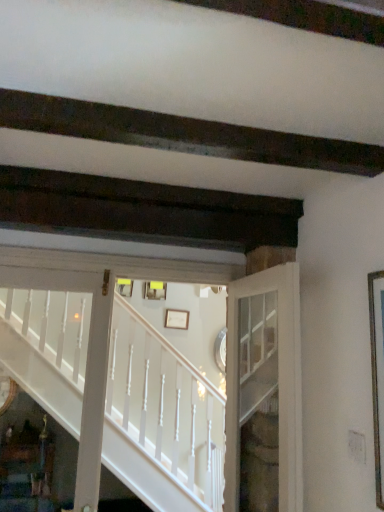
Image resolution: width=384 pixels, height=512 pixels. Describe the element at coordinates (155, 290) in the screenshot. I see `matte yellow picture frame at center, which is counted as the first picture frame, starting from the top` at that location.

The height and width of the screenshot is (512, 384). Describe the element at coordinates (266, 378) in the screenshot. I see `white glass door at center` at that location.

This screenshot has height=512, width=384. Find the location of `white glass door at center`. white glass door at center is located at coordinates tap(266, 378).

In order to face white matte picture frame at center, the 2th picture frame positioned from the left, should I rotate leftwards or rightwards?

You should look left and rotate roughly 2.066 degrees.

Where is `white matte picture frame at center, which is the 1th picture frame from bottom to top`? This screenshot has width=384, height=512. white matte picture frame at center, which is the 1th picture frame from bottom to top is located at coordinates [177, 319].

Where is `matte yellow picture frame at center, which appears as the 2th picture frame when viewed from the right`? The image size is (384, 512). matte yellow picture frame at center, which appears as the 2th picture frame when viewed from the right is located at coordinates (x=155, y=290).

Locate an element on the screen. The height and width of the screenshot is (512, 384). picture frame located below the white painted wood stairs at center (from the image's perspective) is located at coordinates (177, 319).

Based on the photo, how distant is white matte picture frame at center, the 2th picture frame positioned from the left, from white painted wood stairs at center?

1.78 meters.

In terms of height, does white matte picture frame at center, the 2th picture frame positioned from the left, look taller or shorter compared to white painted wood stairs at center?

Clearly, white matte picture frame at center, the 2th picture frame positioned from the left, is shorter compared to white painted wood stairs at center.

Is white matte picture frame at center, which is the second picture frame in top-to-bottom order, thinner than white painted wood stairs at center?

Yes.

From the picture: From the image's perspective, who appears lower, matte yellow picture frame at center, which appears as the 2th picture frame when viewed from the right, or white painted wood stairs at center?

From the image's view, white painted wood stairs at center is below.

Is white painted wood stairs at center located within matte yellow picture frame at center, which appears as the 2th picture frame when viewed from the right?

No, matte yellow picture frame at center, which appears as the 2th picture frame when viewed from the right, does not contain white painted wood stairs at center.

Considering the relative sizes of matte yellow picture frame at center, which is counted as the first picture frame, starting from the top, and white painted wood stairs at center in the image provided, is matte yellow picture frame at center, which is counted as the first picture frame, starting from the top, smaller than white painted wood stairs at center?

Yes, matte yellow picture frame at center, which is counted as the first picture frame, starting from the top, is smaller than white painted wood stairs at center.

Considering the sizes of matte yellow picture frame at center, which is counted as the first picture frame, starting from the top, and white painted wood stairs at center in the image, is matte yellow picture frame at center, which is counted as the first picture frame, starting from the top, taller or shorter than white painted wood stairs at center?

Clearly, matte yellow picture frame at center, which is counted as the first picture frame, starting from the top, is shorter compared to white painted wood stairs at center.

What's the angular difference between white painted wood stairs at center and matte yellow picture frame at center, which is counted as the first picture frame, starting from the top,'s facing directions?

They differ by 1.36 degrees in their facing directions.

From the image's perspective, between white painted wood stairs at center and matte yellow picture frame at center, which appears as the 2th picture frame when viewed from the right, who is located below?

white painted wood stairs at center, from the image's perspective.

Considering the sizes of white painted wood stairs at center and matte yellow picture frame at center, which appears as the 2th picture frame when viewed from the right, in the image, is white painted wood stairs at center wider or thinner than matte yellow picture frame at center, which appears as the 2th picture frame when viewed from the right,?

In the image, white painted wood stairs at center appears to be wider than matte yellow picture frame at center, which appears as the 2th picture frame when viewed from the right.

Considering the positions of objects white glass door at center and white painted wood stairs at center in the image provided, who is behind, white glass door at center or white painted wood stairs at center?

Positioned behind is white painted wood stairs at center.

From the image's perspective, is white glass door at center above or below white painted wood stairs at center?

white glass door at center is situated lower than white painted wood stairs at center in the image.

How different are the orientations of white glass door at center and white painted wood stairs at center in degrees?

There is a 85.3-degree angle between the facing directions of white glass door at center and white painted wood stairs at center.

You are a GUI agent. You are given a task and a screenshot of the screen. Output one action in this format:
    pyautogui.click(x=<x>, y=<y>)
    Task: Click on the stairs behind the white glass door at center
    
    Given the screenshot: What is the action you would take?
    pyautogui.click(x=145, y=473)

This screenshot has width=384, height=512. I want to click on door on the right of matte yellow picture frame at center, which is counted as the first picture frame, starting from the top, so pyautogui.click(x=266, y=378).

Is white glass door at center next to matte yellow picture frame at center, placed as the 1th picture frame when sorted from left to right?

No, white glass door at center is not making contact with matte yellow picture frame at center, placed as the 1th picture frame when sorted from left to right.

From the image's perspective, is white glass door at center below matte yellow picture frame at center, placed as the 1th picture frame when sorted from left to right?

Yes, from the image's perspective, white glass door at center is beneath matte yellow picture frame at center, placed as the 1th picture frame when sorted from left to right.

Are white glass door at center and white matte picture frame at center, which is the 1th picture frame from bottom to top, making contact?

No, white glass door at center is not with white matte picture frame at center, which is the 1th picture frame from bottom to top.

Is white glass door at center inside or outside of white matte picture frame at center, marked as the first picture frame in a right-to-left arrangement?

white glass door at center is not enclosed by white matte picture frame at center, marked as the first picture frame in a right-to-left arrangement.

Is white glass door at center oriented towards white matte picture frame at center, the 2th picture frame positioned from the left?

No, white glass door at center does not turn towards white matte picture frame at center, the 2th picture frame positioned from the left.

Where is `door above the white matte picture frame at center, which is the second picture frame in top-to-bottom order (from the image's perspective)`? door above the white matte picture frame at center, which is the second picture frame in top-to-bottom order (from the image's perspective) is located at coordinates (266, 378).

Considering their positions, is matte yellow picture frame at center, which is counted as the first picture frame, starting from the top, located in front of or behind white glass door at center?

In the image, matte yellow picture frame at center, which is counted as the first picture frame, starting from the top, appears behind white glass door at center.

In the scene shown: How different are the orientations of matte yellow picture frame at center, placed as the 1th picture frame when sorted from left to right, and white glass door at center in degrees?

83.9 degrees separate the facing orientations of matte yellow picture frame at center, placed as the 1th picture frame when sorted from left to right, and white glass door at center.

Is matte yellow picture frame at center, which appears as the 2th picture frame when viewed from the right, completely or partially outside of white glass door at center?

Indeed, matte yellow picture frame at center, which appears as the 2th picture frame when viewed from the right, is completely outside white glass door at center.

Is point (157, 282) farther from viewer compared to point (293, 406)?

Yes, it is behind point (293, 406).

The image size is (384, 512). What are the coordinates of `the 1st picture frame directly above the white painted wood stairs at center (from a real-world perspective)` in the screenshot? It's located at (177, 319).

At what (x,y) coordinates should I click in order to perform the action: click on picture frame located on the left of white painted wood stairs at center. Please return your answer as a coordinate pair (x, y). This screenshot has height=512, width=384. Looking at the image, I should click on (155, 290).

Consider the image. Estimate the real-world distances between objects in this image. Which object is closer to white matte picture frame at center, which is the 1th picture frame from bottom to top, matte yellow picture frame at center, acting as the 2th picture frame starting from the bottom, or white glass door at center?

matte yellow picture frame at center, acting as the 2th picture frame starting from the bottom, is closer to white matte picture frame at center, which is the 1th picture frame from bottom to top.

When comparing their distances from matte yellow picture frame at center, which is counted as the first picture frame, starting from the top, does white glass door at center or white matte picture frame at center, which is the second picture frame in top-to-bottom order, seem closer?

white matte picture frame at center, which is the second picture frame in top-to-bottom order, is closer to matte yellow picture frame at center, which is counted as the first picture frame, starting from the top.

When comparing their distances from white painted wood stairs at center, does matte yellow picture frame at center, which is counted as the first picture frame, starting from the top, or white matte picture frame at center, marked as the first picture frame in a right-to-left arrangement, seem closer?

The object closer to white painted wood stairs at center is matte yellow picture frame at center, which is counted as the first picture frame, starting from the top.

When comparing their distances from white glass door at center, does white matte picture frame at center, the 2th picture frame positioned from the left, or white painted wood stairs at center seem closer?

white painted wood stairs at center is closer to white glass door at center.

When comparing their distances from matte yellow picture frame at center, acting as the 2th picture frame starting from the bottom, does white matte picture frame at center, marked as the first picture frame in a right-to-left arrangement, or white painted wood stairs at center seem closer?

Based on the image, white matte picture frame at center, marked as the first picture frame in a right-to-left arrangement, appears to be nearer to matte yellow picture frame at center, acting as the 2th picture frame starting from the bottom.

Looking at the image, which one is located closer to white matte picture frame at center, which is the second picture frame in top-to-bottom order, white painted wood stairs at center or white glass door at center?

white painted wood stairs at center is closer to white matte picture frame at center, which is the second picture frame in top-to-bottom order.

Estimate the real-world distances between objects in this image. Which object is further from white painted wood stairs at center, white matte picture frame at center, which is the 1th picture frame from bottom to top, or white glass door at center?

white matte picture frame at center, which is the 1th picture frame from bottom to top, is further to white painted wood stairs at center.

Which object lies further to the anchor point white painted wood stairs at center, white glass door at center or white matte picture frame at center, which is the second picture frame in top-to-bottom order?

white matte picture frame at center, which is the second picture frame in top-to-bottom order, is further to white painted wood stairs at center.

Where is `picture frame located between white painted wood stairs at center and matte yellow picture frame at center, which appears as the 2th picture frame when viewed from the right, in the depth direction`? The width and height of the screenshot is (384, 512). picture frame located between white painted wood stairs at center and matte yellow picture frame at center, which appears as the 2th picture frame when viewed from the right, in the depth direction is located at coordinates (177, 319).

The height and width of the screenshot is (512, 384). Identify the location of stairs positioned between white glass door at center and white matte picture frame at center, marked as the first picture frame in a right-to-left arrangement, from near to far. (145, 473).

The image size is (384, 512). Find the location of `picture frame located between white glass door at center and matte yellow picture frame at center, which is counted as the first picture frame, starting from the top, in the depth direction`. picture frame located between white glass door at center and matte yellow picture frame at center, which is counted as the first picture frame, starting from the top, in the depth direction is located at coordinates (177, 319).

Locate an element on the screen. The image size is (384, 512). stairs positioned between white glass door at center and matte yellow picture frame at center, which is counted as the first picture frame, starting from the top, from near to far is located at coordinates (145, 473).